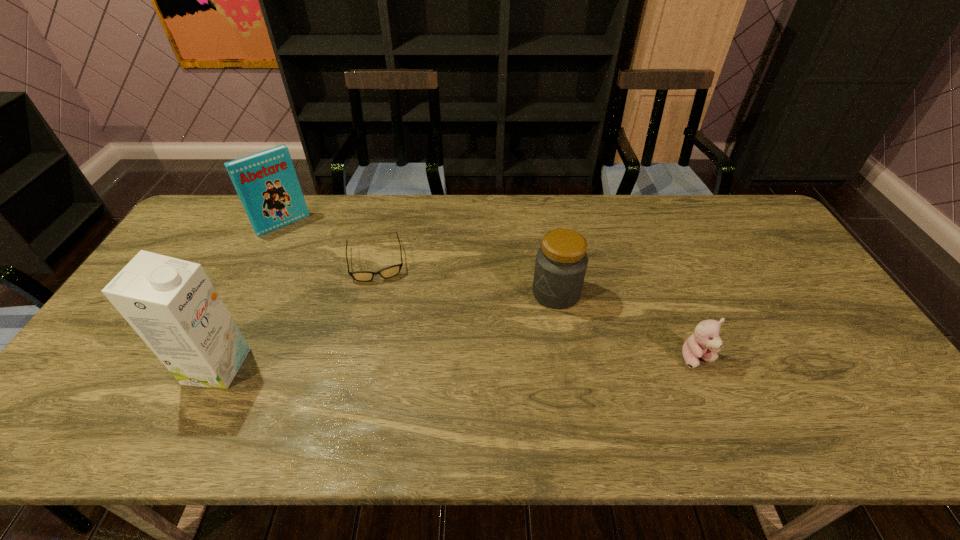
Identify the location of vacant space on the desktop that is between the tallest object and the teddy bear and is positioned on the surface of the jar near the warning symbol. This screenshot has width=960, height=540. (444, 362).

Locate an element on the screen. free spot on the desktop that is between the carton and the rightmost object and is positioned on the front-facing side of the shortest object is located at coordinates [388, 363].

Find the location of a particular element. free space on the desktop that is between the tallest object and the fourth tallest object and is positioned on the front cover of the farthest object is located at coordinates (397, 363).